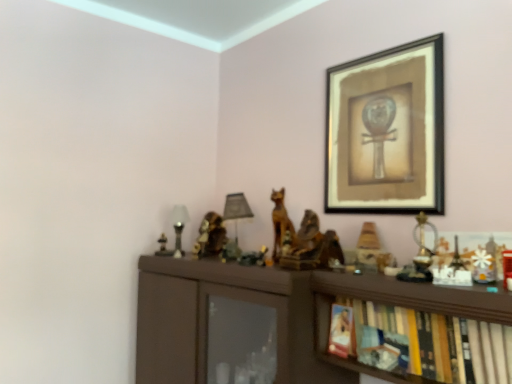
What is the approximate height of wooden bookshelf at lower right?

wooden bookshelf at lower right is 7.78 inches in height.

You are a GUI agent. You are given a task and a screenshot of the screen. Output one action in this format:
    pyautogui.click(x=<x>, y=<y>)
    Task: Click on the matte black table lamp at center, the 2th table lamp positioned from the left
    The image size is (512, 384).
    Given the screenshot: What is the action you would take?
    pyautogui.click(x=236, y=212)

What are the coordinates of `metallic gold statue at right, which is the third toy from back to front` in the screenshot? It's located at (421, 253).

Measure the distance between white plastic snowflake at upper right, which is the fourth toy from back to front, and camera.

white plastic snowflake at upper right, which is the fourth toy from back to front, is 38.61 inches from camera.

What do you see at coordinates (281, 227) in the screenshot? Image resolution: width=512 pixels, height=384 pixels. I see `wooden statue at center` at bounding box center [281, 227].

Identify the location of wooden bookshelf at lower right. (417, 329).

Considering the relative sizes of metallic gold cross at left, the first toy when ordered from left to right, and black matte picture frame at upper right in the image provided, is metallic gold cross at left, the first toy when ordered from left to right, smaller than black matte picture frame at upper right?

Correct, metallic gold cross at left, the first toy when ordered from left to right, occupies less space than black matte picture frame at upper right.

Find the location of `picture frame above the metallic gold cross at left, the 4th toy when ordered from front to back (from the image's perspective)`. picture frame above the metallic gold cross at left, the 4th toy when ordered from front to back (from the image's perspective) is located at coordinates (387, 131).

Is point (164, 242) farther from viewer compared to point (439, 99)?

Yes.

In terms of height, does metallic gold cross at left, the fourth toy viewed from the right, look taller or shorter compared to black matte picture frame at upper right?

Clearly, metallic gold cross at left, the fourth toy viewed from the right, is shorter compared to black matte picture frame at upper right.

Is wooden figurine at center-right, the 2th toy in the left-to-right sequence, in contact with black matte picture frame at upper right?

No.

Is wooden figurine at center-right, the third toy in the front-to-back sequence, wider than black matte picture frame at upper right?

Indeed, wooden figurine at center-right, the third toy in the front-to-back sequence, has a greater width compared to black matte picture frame at upper right.

From the image's perspective, which one is positioned lower, wooden figurine at center-right, which is counted as the third toy, starting from the right, or black matte picture frame at upper right?

From the image's view, wooden figurine at center-right, which is counted as the third toy, starting from the right, is below.

Which object is more forward, wooden figurine at center-right, the 2th toy in the left-to-right sequence, or black matte picture frame at upper right?

black matte picture frame at upper right is closer to the camera.

How much distance is there between wooden figurine at center-right, the 2th toy in the left-to-right sequence, and wooden statue at center?

The distance of wooden figurine at center-right, the 2th toy in the left-to-right sequence, from wooden statue at center is 10.90 inches.

Is wooden figurine at center-right, which is counted as the third toy, starting from the right, spatially inside wooden statue at center, or outside of it?

wooden figurine at center-right, which is counted as the third toy, starting from the right, cannot be found inside wooden statue at center.

Relative to wooden statue at center, is wooden figurine at center-right, which is counted as the third toy, starting from the right, in front or behind?

Visually, wooden figurine at center-right, which is counted as the third toy, starting from the right, is located in front of wooden statue at center.

Is wooden statue at center at the back of wooden figurine at center-right, the 2th toy in the left-to-right sequence?

No, wooden figurine at center-right, the 2th toy in the left-to-right sequence, is not facing away from wooden statue at center.

What's the angular difference between white plastic snowflake at upper right, arranged as the 1th toy when viewed from the right, and metallic gold cross at left, which ranks as the 1th toy in back-to-front order,'s facing directions?

white plastic snowflake at upper right, arranged as the 1th toy when viewed from the right, and metallic gold cross at left, which ranks as the 1th toy in back-to-front order, are facing 1.82 degrees away from each other.

Consider the image. Who is bigger, white plastic snowflake at upper right, arranged as the 1th toy when viewed from the right, or metallic gold cross at left, the first toy when ordered from left to right?

Bigger between the two is metallic gold cross at left, the first toy when ordered from left to right.

Can metallic gold cross at left, the 4th toy when ordered from front to back, be found inside white plastic snowflake at upper right, arranged as the 1th toy when viewed from the right?

Definitely not — metallic gold cross at left, the 4th toy when ordered from front to back, is not inside white plastic snowflake at upper right, arranged as the 1th toy when viewed from the right.

How far apart are white plastic snowflake at upper right, which is the 4th toy from left to right, and metallic gold cross at left, the 4th toy when ordered from front to back?

white plastic snowflake at upper right, which is the 4th toy from left to right, and metallic gold cross at left, the 4th toy when ordered from front to back, are 1.13 meters apart from each other.

Is wooden bookshelf at lower right surrounding wooden statue at center?

No.

I want to click on shelf below the wooden statue at center (from a real-world perspective), so click(x=417, y=329).

How different are the orientations of wooden bookshelf at lower right and wooden statue at center in degrees?

They differ by 7.79 degrees in their facing directions.

Between wooden bookshelf at lower right and wooden statue at center, which one appears on the left side from the viewer's perspective?

wooden statue at center.

Considering the relative sizes of wooden figurine at center-right, placed as the second toy when sorted from back to front, and wooden bookshelf at lower right in the image provided, is wooden figurine at center-right, placed as the second toy when sorted from back to front, thinner than wooden bookshelf at lower right?

Correct, the width of wooden figurine at center-right, placed as the second toy when sorted from back to front, is less than that of wooden bookshelf at lower right.

Considering the positions of points (392, 259) and (499, 382), is point (392, 259) farther from camera compared to point (499, 382)?

That is True.

Is wooden figurine at center-right, which is counted as the third toy, starting from the right, aimed at wooden bookshelf at lower right?

No, wooden figurine at center-right, which is counted as the third toy, starting from the right, is not facing towards wooden bookshelf at lower right.

From a real-world perspective, which is physically below, wooden figurine at center-right, the third toy in the front-to-back sequence, or wooden bookshelf at lower right?

From a 3D spatial view, wooden bookshelf at lower right is below.

Does white plastic snowflake at upper right, the first toy when ordered from front to back, have a lesser width compared to metallic gold statue at right, arranged as the 2th toy when viewed from the front?

Yes.

From a real-world perspective, is white plastic snowflake at upper right, arranged as the 1th toy when viewed from the right, positioned over metallic gold statue at right, arranged as the 3th toy when viewed from the left, based on gravity?

No, from a real-world perspective, white plastic snowflake at upper right, arranged as the 1th toy when viewed from the right, is not above metallic gold statue at right, arranged as the 3th toy when viewed from the left.

From the image's perspective, which one is positioned lower, white plastic snowflake at upper right, which is the 4th toy from left to right, or metallic gold statue at right, the second toy positioned from the right?

white plastic snowflake at upper right, which is the 4th toy from left to right, from the image's perspective.

Which is more to the right, white plastic snowflake at upper right, the first toy when ordered from front to back, or metallic gold statue at right, the second toy positioned from the right?

Positioned to the right is white plastic snowflake at upper right, the first toy when ordered from front to back.

The width and height of the screenshot is (512, 384). I want to click on picture frame above the metallic gold cross at left, which ranks as the 1th toy in back-to-front order (from a real-world perspective), so click(387, 131).

Find the location of a particular element. The image size is (512, 384). picture frame in front of the wooden figurine at center-right, the 2th toy in the left-to-right sequence is located at coordinates (387, 131).

When comparing their distances from white plastic snowflake at upper right, which is the fourth toy from back to front, does metallic gold cross at left, the fourth toy viewed from the right, or black matte picture frame at upper right seem closer?

black matte picture frame at upper right is closer to white plastic snowflake at upper right, which is the fourth toy from back to front.

When comparing their distances from matte black table lamp at center, the 2th table lamp positioned from the left, does white plastic snowflake at upper right, arranged as the 1th toy when viewed from the right, or black matte picture frame at upper right seem further?

white plastic snowflake at upper right, arranged as the 1th toy when viewed from the right.

Looking at the image, which one is located further to matte black table lamp at center, the 2th table lamp positioned from the left, wooden figurine at center-right, placed as the second toy when sorted from back to front, or black matte picture frame at upper right?

Among the two, black matte picture frame at upper right is located further to matte black table lamp at center, the 2th table lamp positioned from the left.

Considering their positions, is wooden figurine at center-right, placed as the second toy when sorted from back to front, positioned closer to wooden statue at center than black matte picture frame at upper right?

wooden figurine at center-right, placed as the second toy when sorted from back to front, is positioned closer to the anchor wooden statue at center.

Which object lies further to the anchor point metallic gold statue at right, which is the third toy from back to front, white plastic snowflake at upper right, the first toy when ordered from front to back, or wooden figurine at center-right, placed as the second toy when sorted from back to front?

Among the two, white plastic snowflake at upper right, the first toy when ordered from front to back, is located further to metallic gold statue at right, which is the third toy from back to front.

Based on their spatial positions, is wooden statue at center or metallic gold statue at right, arranged as the 2th toy when viewed from the front, closer to wooden figurine at center-right, the third toy in the front-to-back sequence?

metallic gold statue at right, arranged as the 2th toy when viewed from the front, is closer to wooden figurine at center-right, the third toy in the front-to-back sequence.

In the scene shown: Based on their spatial positions, is metallic gold cross at left, the fourth toy viewed from the right, or white plastic snowflake at upper right, the first toy when ordered from front to back, further from matte black table lamp at center, the 2th table lamp positioned from the left?

white plastic snowflake at upper right, the first toy when ordered from front to back, lies further to matte black table lamp at center, the 2th table lamp positioned from the left, than the other object.

Looking at the image, which one is located further to white plastic snowflake at upper right, arranged as the 1th toy when viewed from the right, wooden figurine at center-right, which is counted as the third toy, starting from the right, or metallic gold cross at left, the first toy when ordered from left to right?

metallic gold cross at left, the first toy when ordered from left to right, is further to white plastic snowflake at upper right, arranged as the 1th toy when viewed from the right.

Where is `toy located between matte glass table lamp at left, which ranks as the 1th table lamp in left-to-right order, and black matte picture frame at upper right in the left-right direction`? This screenshot has width=512, height=384. toy located between matte glass table lamp at left, which ranks as the 1th table lamp in left-to-right order, and black matte picture frame at upper right in the left-right direction is located at coordinates (371, 250).

I want to click on animal between metallic gold cross at left, the fourth toy viewed from the right, and metallic gold statue at right, the second toy positioned from the right, from left to right, so click(281, 227).

At what (x,y) coordinates should I click in order to perform the action: click on animal between matte black table lamp at center, the 2th table lamp positioned from the left, and black matte picture frame at upper right from left to right. Please return your answer as a coordinate pair (x, y). Looking at the image, I should click on (281, 227).

I want to click on table lamp between matte glass table lamp at left, which ranks as the 2th table lamp in right-to-left order, and wooden statue at center, in the horizontal direction, so click(236, 212).